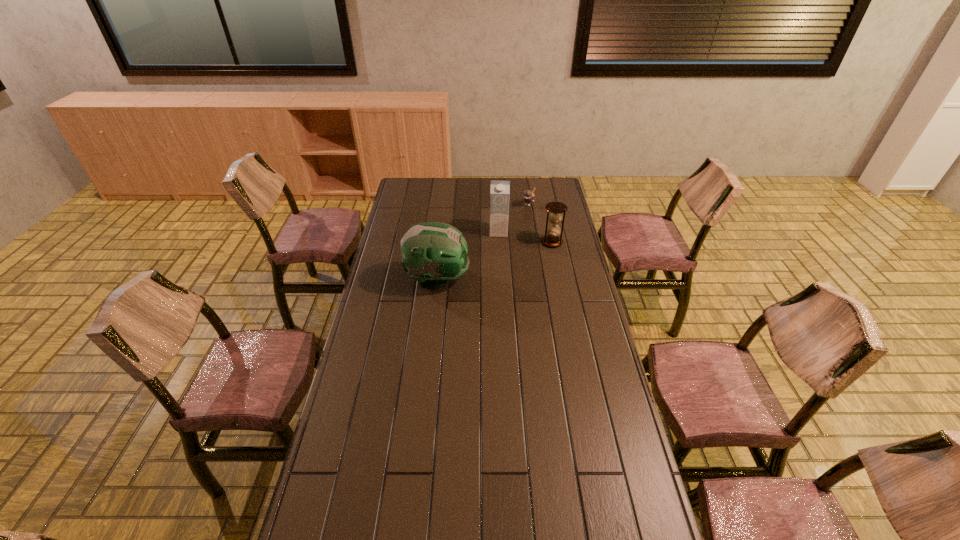
Find the location of a particular element. free space on the desktop that is between the nearest object and the second shortest object and is positioned on the front-facing side of the kitten is located at coordinates (481, 265).

Find the location of a particular element. This screenshot has width=960, height=540. free spot on the desktop that is between the football helmet and the hourglass and is positioned on the front label of the third object from right to left is located at coordinates (498, 260).